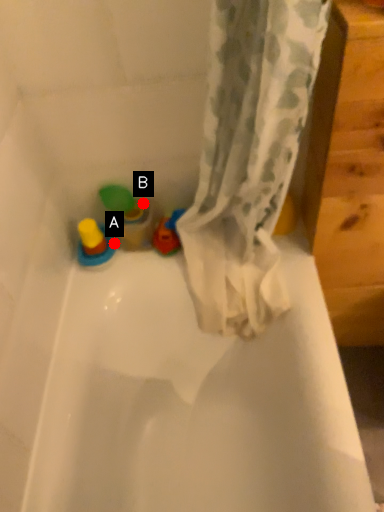
Question: Two points are circled on the image, labeled by A and B beside each circle. Which point is further to the camera?

Choices:
 (A) A is further
 (B) B is further

Answer: (B)